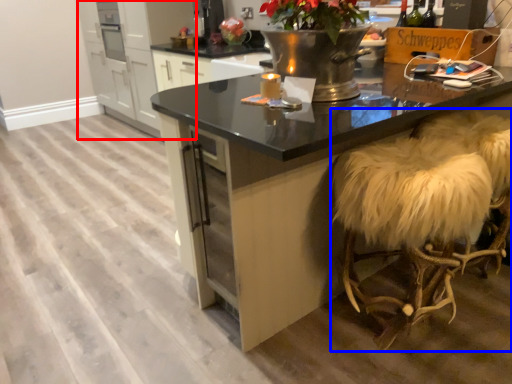
Question: Which point is closer to the camera, cabinetry (highlighted by a red box) or swivel chair (highlighted by a blue box)?

Choices:
 (A) cabinetry
 (B) swivel chair

Answer: (B)